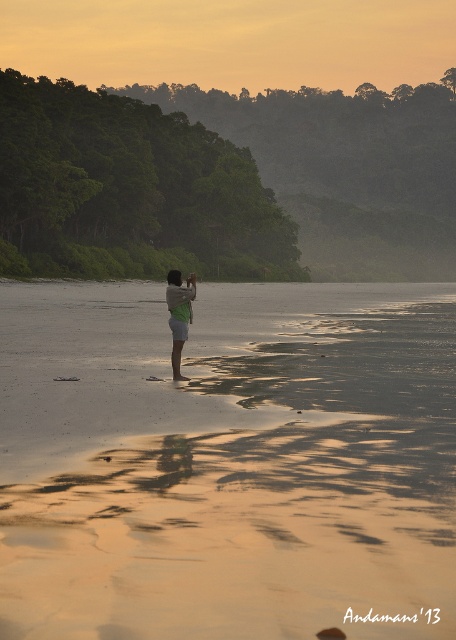
Does sandy beach at center have a greater width compared to green fabric shorts at center?

Yes, sandy beach at center is wider than green fabric shorts at center.

Is point (79, 332) farther from camera compared to point (186, 298)?

Yes.

Find the location of a particular element. Image resolution: width=456 pixels, height=640 pixels. sandy beach at center is located at coordinates (228, 461).